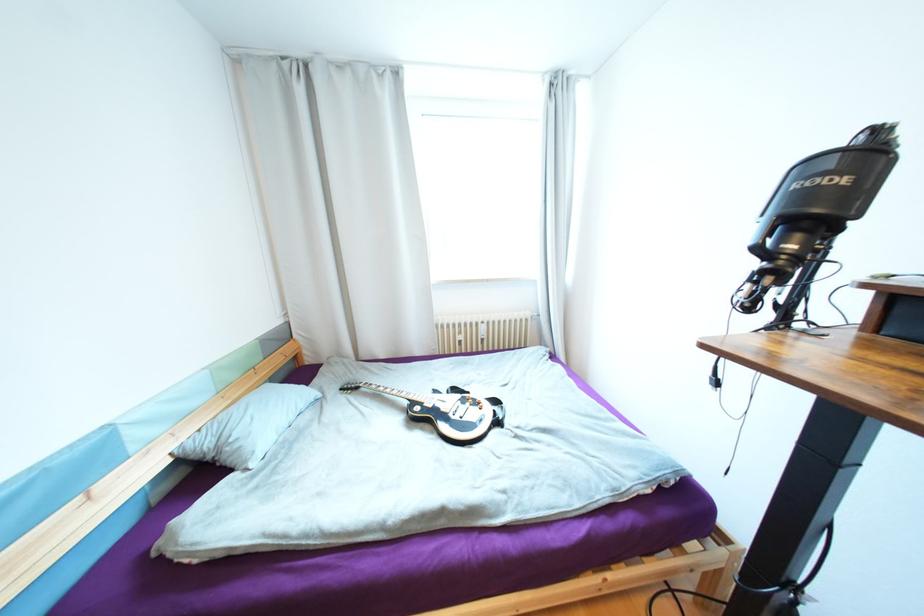
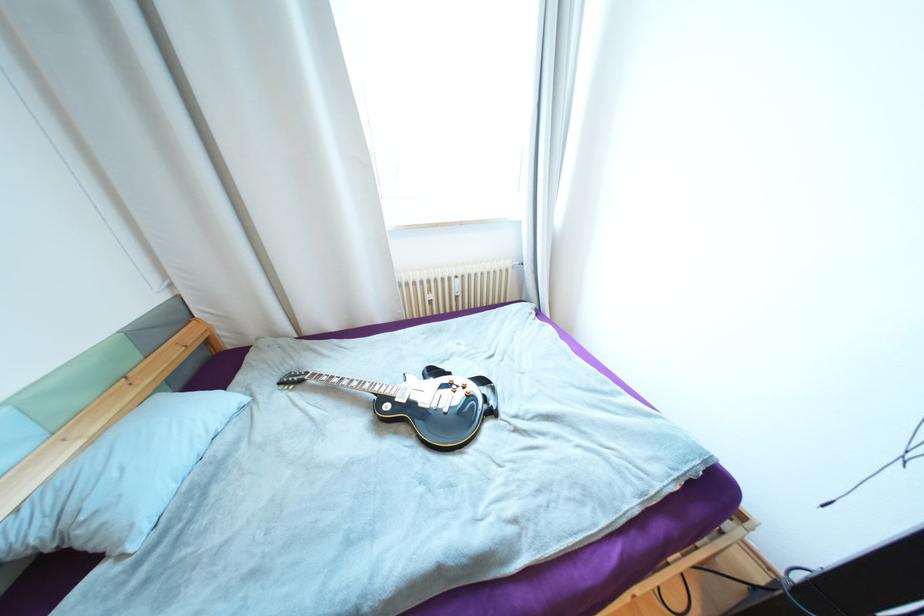
Question: What movement of the cameraman would produce the second image?

Choices:
 (A) Left
 (B) Right
 (C) Forward
 (D) Backward

Answer: (C)